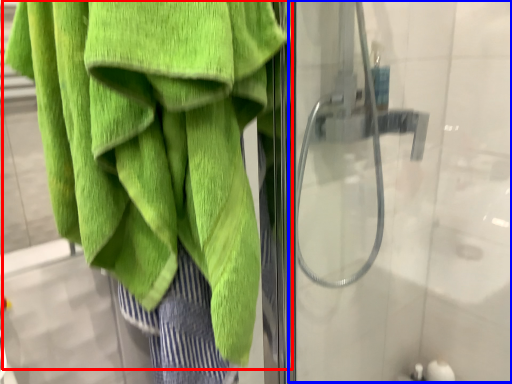
Question: Which object is closer to the camera taking this photo, towel (highlighted by a red box) or screen door (highlighted by a blue box)?

Choices:
 (A) towel
 (B) screen door

Answer: (A)